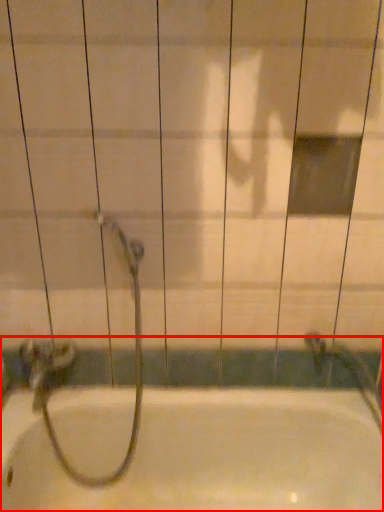
Question: From the image's perspective, where is bathtub (annotated by the red box) located in relation to garden hose in the image?

Choices:
 (A) above
 (B) below

Answer: (B)